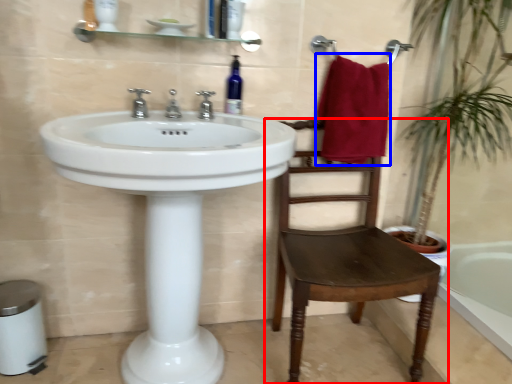
Question: Which of the following is the closest to the observer, chair (highlighted by a red box) or bath towel (highlighted by a blue box)?

Choices:
 (A) chair
 (B) bath towel

Answer: (A)